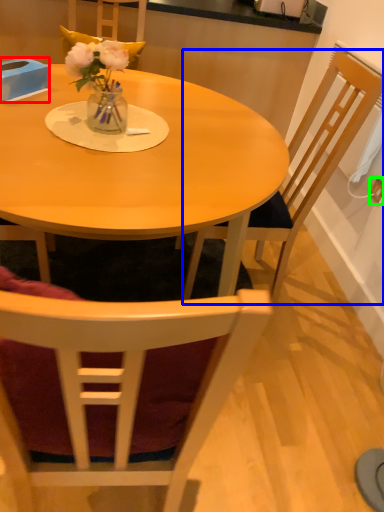
Question: Which is farther away from box (highlighted by a red box)? chair (highlighted by a blue box) or power outlet (highlighted by a green box)?

Choices:
 (A) chair
 (B) power outlet

Answer: (B)